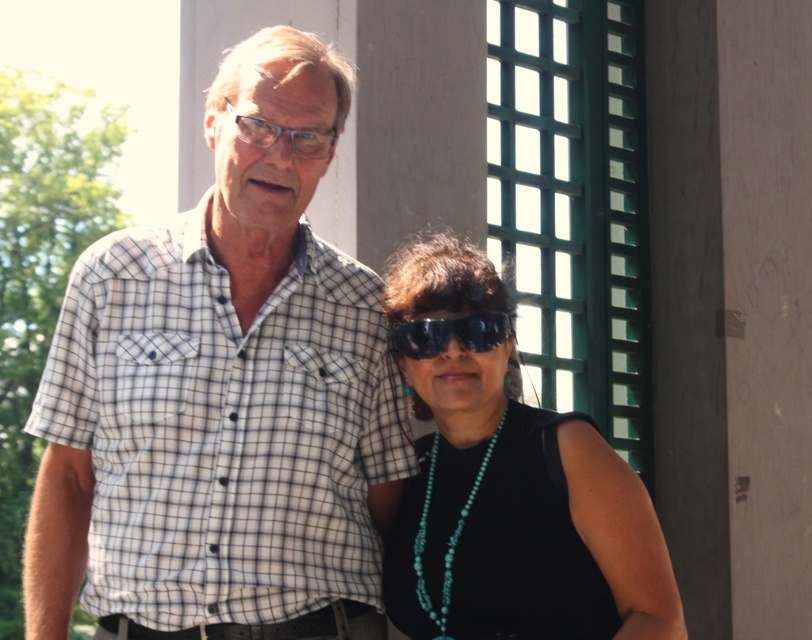
Is turquoise beaded necklace at center smaller than black plastic goggles at center?

No.

Who is positioned more to the right, turquoise beaded necklace at center or black plastic goggles at center?

turquoise beaded necklace at center

Between point (653, 524) and point (417, 332), which one is positioned in front?

Positioned in front is point (653, 524).

At what (x,y) coordinates should I click in order to perform the action: click on turquoise beaded necklace at center. Please return your answer as a coordinate pair (x, y). The width and height of the screenshot is (812, 640). Looking at the image, I should click on (520, 518).

Is white checkered shirt at center shorter than black plastic goggles at center?

Incorrect, white checkered shirt at center's height does not fall short of black plastic goggles at center's.

Between white checkered shirt at center and black plastic goggles at center, which one has more height?

With more height is white checkered shirt at center.

Where is `white checkered shirt at center`? white checkered shirt at center is located at coordinates (223, 394).

From the picture: Can you confirm if white checkered shirt at center is thinner than turquoise beaded necklace at center?

Incorrect, white checkered shirt at center's width is not less than turquoise beaded necklace at center's.

Can you confirm if white checkered shirt at center is taller than turquoise beaded necklace at center?

Yes.

Does point (274, 371) come behind point (437, 580)?

Yes.

You are a GUI agent. You are given a task and a screenshot of the screen. Output one action in this format:
    pyautogui.click(x=<x>, y=<y>)
    Task: Click on the white checkered shirt at center
    The image size is (812, 640).
    Given the screenshot: What is the action you would take?
    pyautogui.click(x=223, y=394)